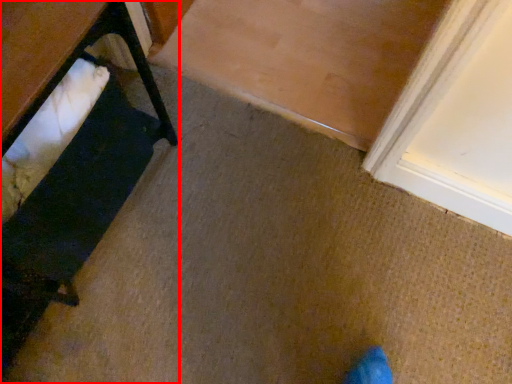
Question: From the image's perspective, what is the correct spatial positioning of furniture (annotated by the red box) in reference to table?

Choices:
 (A) above
 (B) below

Answer: (B)